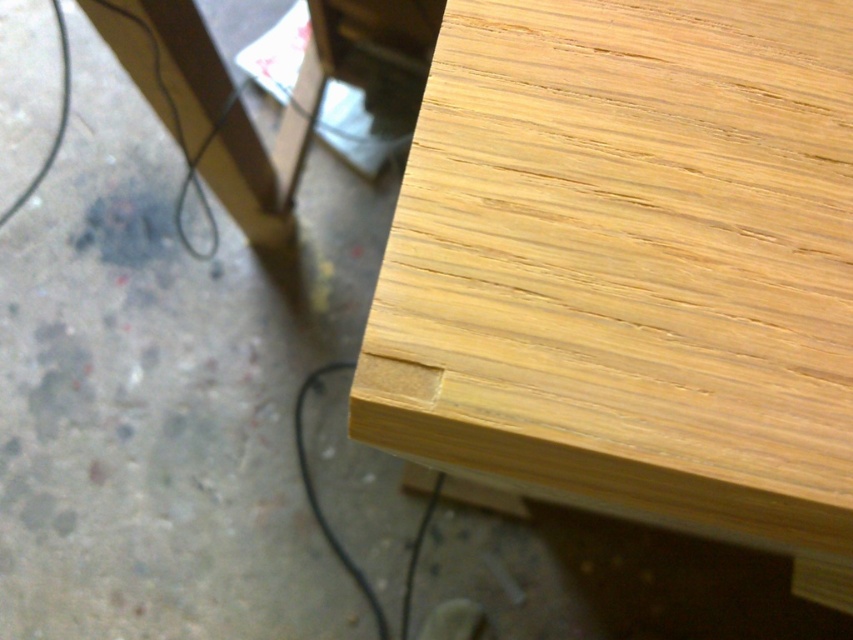
Which of these two, natural wood table at upper right or black rubber wire at lower center, stands shorter?

natural wood table at upper right is shorter.

Is natural wood table at upper right thinner than black rubber wire at lower center?

Incorrect, natural wood table at upper right's width is not less than black rubber wire at lower center's.

At what (x,y) coordinates should I click in order to perform the action: click on natural wood table at upper right. Please return your answer as a coordinate pair (x, y). Looking at the image, I should click on (631, 268).